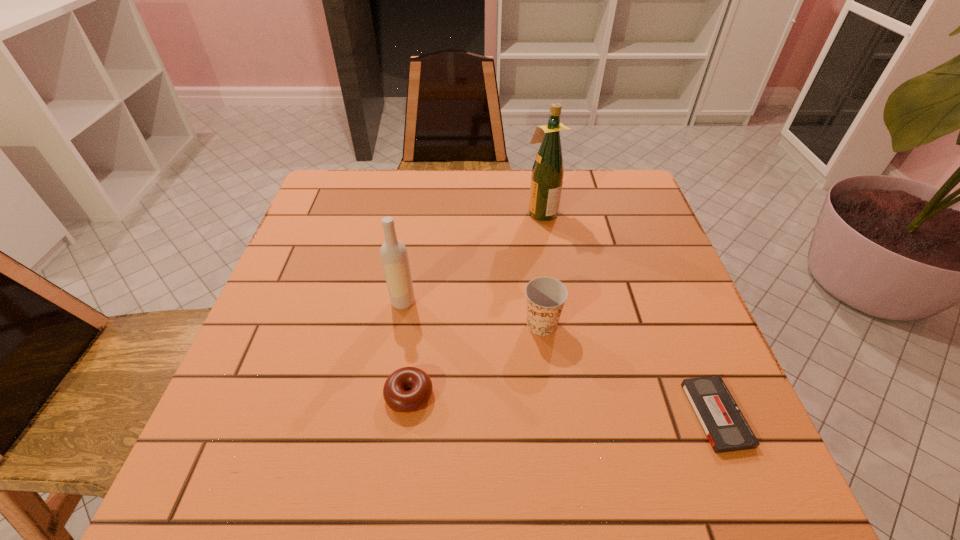
Find the location of a particular element. free space at the left edge is located at coordinates (325, 271).

Where is `vacant space at the right edge of the desktop`? This screenshot has width=960, height=540. vacant space at the right edge of the desktop is located at coordinates (610, 241).

Image resolution: width=960 pixels, height=540 pixels. Identify the location of vacant position at the far left corner of the desktop. (329, 186).

Where is `blank space at the far right corner`? blank space at the far right corner is located at coordinates (607, 209).

The image size is (960, 540). Identify the location of free space that is in between the liquor and the third shortest object. (541, 268).

This screenshot has width=960, height=540. I want to click on vacant area between the vodka and the Dixie cup, so click(x=472, y=313).

I want to click on free space between the second tallest object and the Dixie cup, so [472, 313].

Locate an element on the screen. This screenshot has height=540, width=960. free point between the shortest object and the second shortest object is located at coordinates [x=563, y=404].

Where is `unoccupied position between the doughnut and the Dixie cup`? unoccupied position between the doughnut and the Dixie cup is located at coordinates (475, 360).

Locate an element on the screen. vacant area between the third shortest object and the videotape is located at coordinates (629, 369).